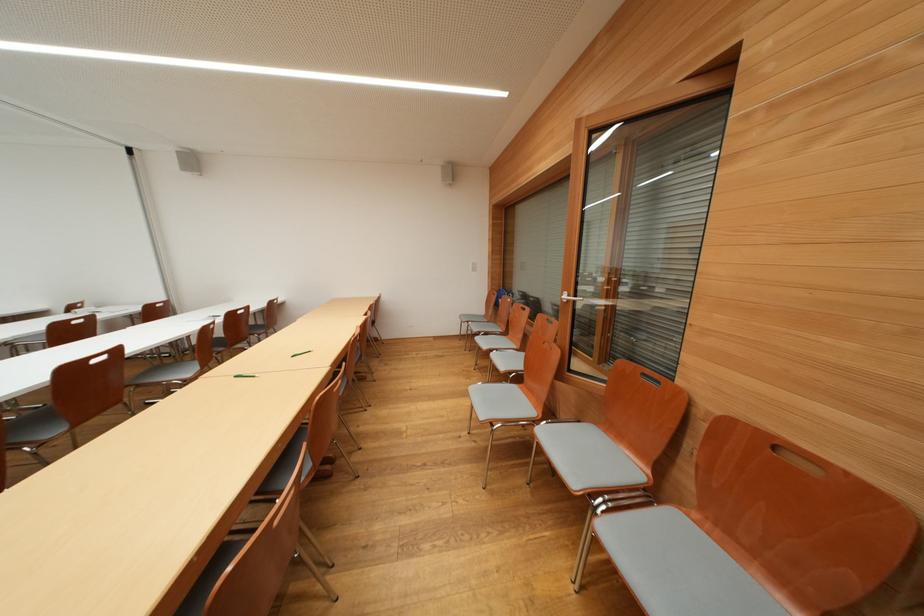
Find where to push the white light switch. Please return your answer as a coordinate pair (x, y).

(473, 265)